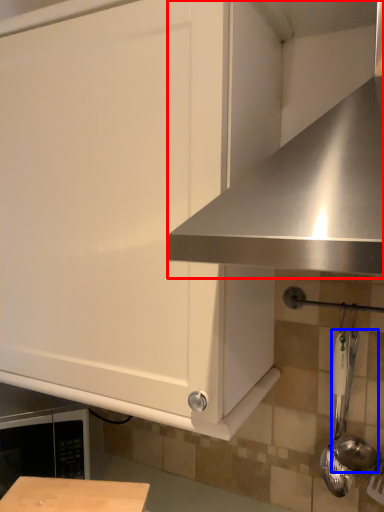
Question: Which point is closer to the camera, exhaust hood (highlighted by a red box) or utensil (highlighted by a blue box)?

Choices:
 (A) exhaust hood
 (B) utensil

Answer: (A)